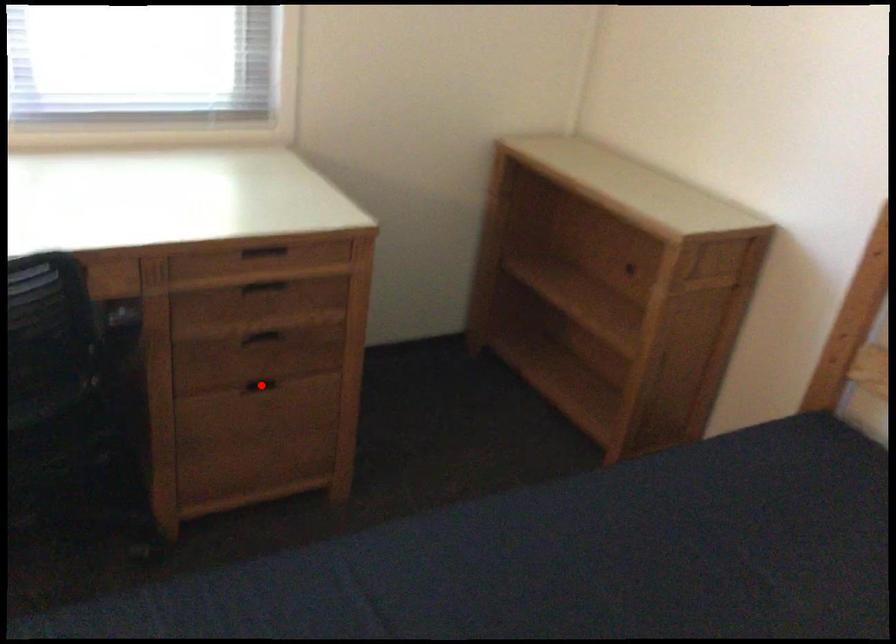
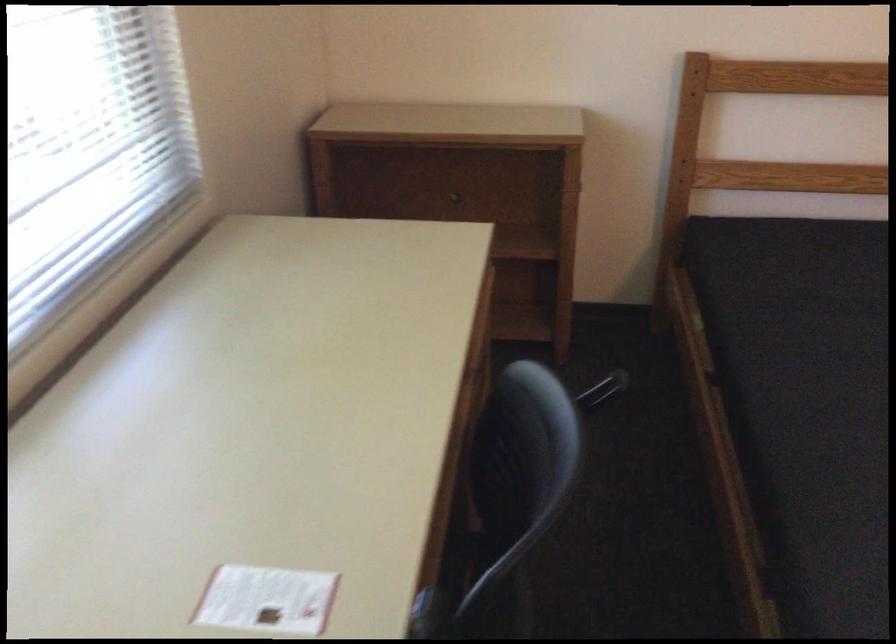
Question: I am providing you with two images of the same scene from different viewpoints. A red point is marked on the first image. Can you still see the location of the red point in image 2?

Choices:
 (A) Yes
 (B) No

Answer: (B)